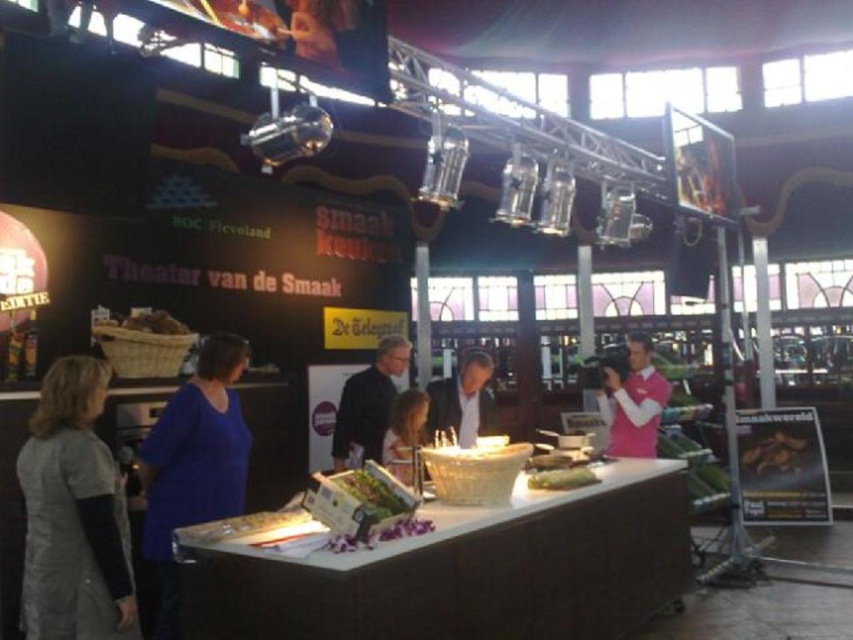
You are a photographer taking a photo of the Theater van de Smaak booth. You notice the dark brown leather jacket at center and the light brown hair at center. Which object should you focus on first to ensure both are in frame but the taller one is properly captured?

The dark brown leather jacket at center is taller than the light brown hair at center. To ensure both are in frame and the taller one is properly captured, focus on the dark brown leather jacket at center first.

You are a visitor at the food event booth and see the pink jersey at right and the dark gray suit at center. Which person is standing closer to the front of the booth?

The pink jersey at right is positioned under dark gray suit at center, meaning it is closer to the front of the booth.

You are a visitor at the event and want to take a photo of both the pink jersey at right and the green leafy vegetable at center. Since you want both objects to be clearly visible in the frame, which object should you focus on first to ensure proper focus?

You should focus on the pink jersey at right first because it is taller than the green leafy vegetable at center, so focusing on the taller object first ensures that both will be in focus when using depth of field.